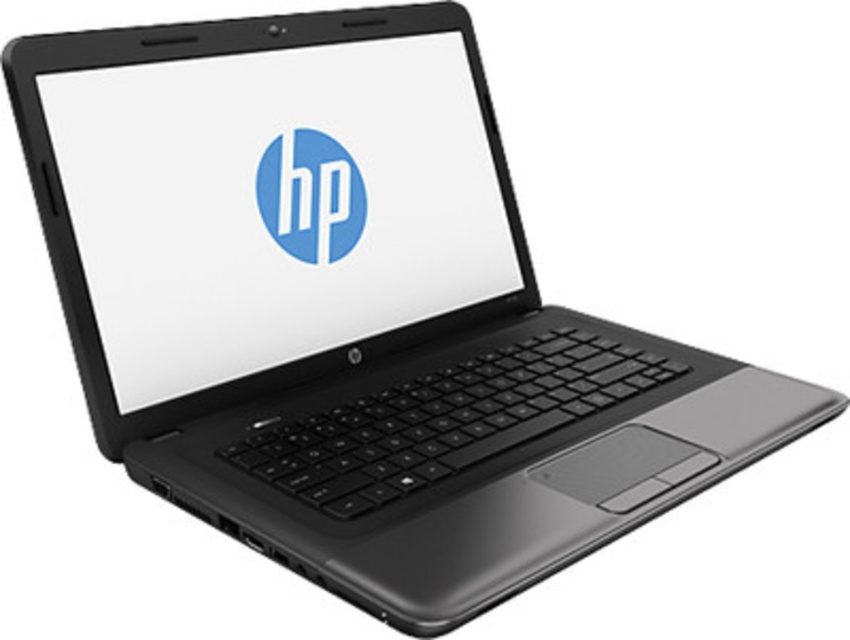
You are looking at the black HP laptop from the front. There are two points on the laptop screen labeled as point (364, 115) and point (258, 180). Which point is closer to you?

Point (364, 115) is further to the viewer than point (258, 180), so point (364, 115) is closer to you.

You are a graphic designer working on a project that requires precise alignment between elements. You have a matte black screen at center and a blue glossy logo at center on your HP laptop. To ensure proper spacing, how far apart are these two elements?

The distance between the matte black screen at center and the blue glossy logo at center is 2.00 inches.